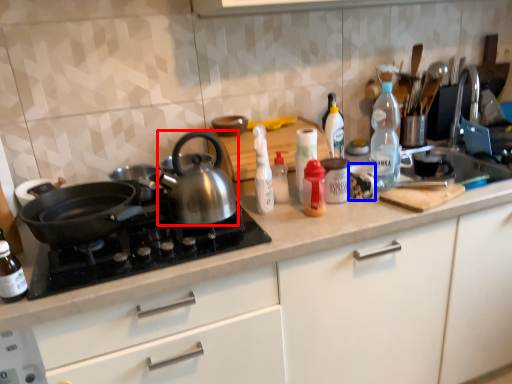
Question: Which point is further to the camera, kettle (highlighted by a red box) or tableware (highlighted by a blue box)?

Choices:
 (A) kettle
 (B) tableware

Answer: (B)